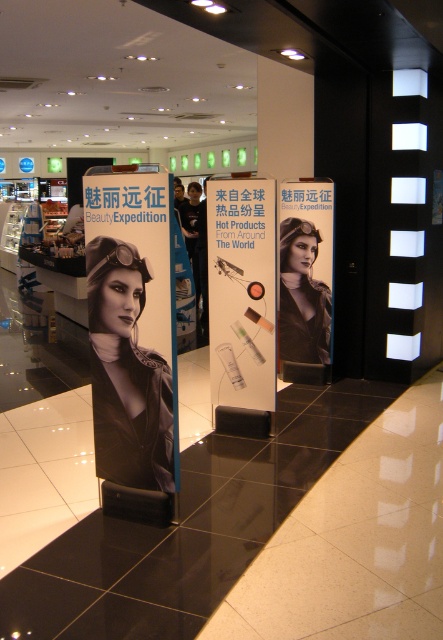
You are a store manager checking the display area. You notice the black glossy poster at center and the matte black helmet at center. Which object is shorter in height?

The black glossy poster at center has a lesser height compared to the matte black helmet at center, so the black glossy poster at center is shorter.